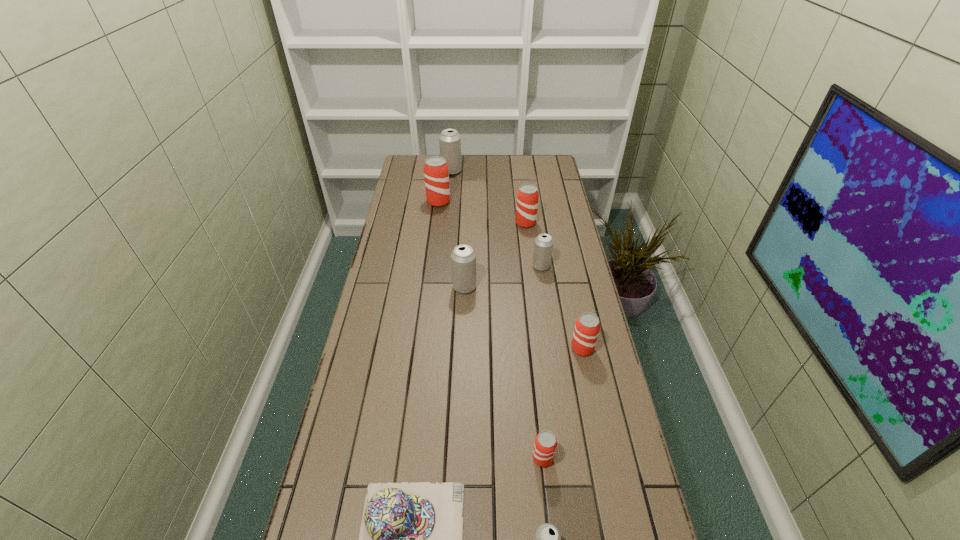
Identify the location of the second farthest white beer can. (543, 247).

Image resolution: width=960 pixels, height=540 pixels. What are the coordinates of `the fourth farthest object` in the screenshot? It's located at (543, 247).

Locate an element on the screen. the smallest orange beer can is located at coordinates (545, 445).

Image resolution: width=960 pixels, height=540 pixels. Identify the location of the nearest orange beer can. (545, 445).

Locate an element on the screen. free space located on the left of the farthest beer can is located at coordinates (429, 171).

Where is `free location located on the front of the biggest orange beer can`? free location located on the front of the biggest orange beer can is located at coordinates (434, 243).

Locate an element on the screen. The width and height of the screenshot is (960, 540). vacant region located on the back of the third smallest orange beer can is located at coordinates (518, 169).

Where is `free spot located on the right of the second biggest white beer can`? Image resolution: width=960 pixels, height=540 pixels. free spot located on the right of the second biggest white beer can is located at coordinates (514, 287).

The width and height of the screenshot is (960, 540). I want to click on vacant space located 0.260m on the back of the fourth nearest object, so point(568,282).

Locate an element on the screen. vacant region located on the back of the rightmost white beer can is located at coordinates (535, 225).